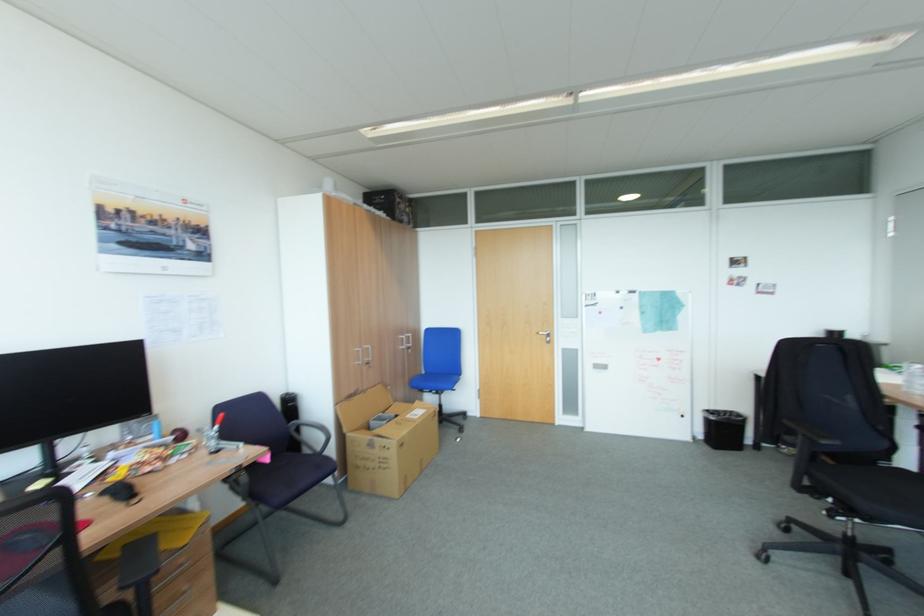
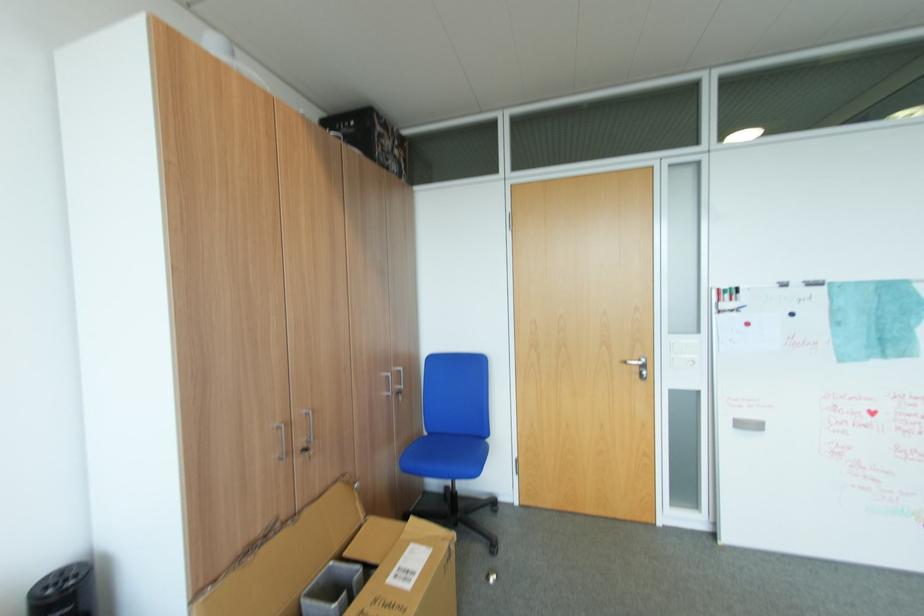
Question: Which direction would the cameraman need to move to produce the second image? Reply with the corresponding letter.

Choices:
 (A) Left
 (B) Right
 (C) Forward
 (D) Backward

Answer: (C)